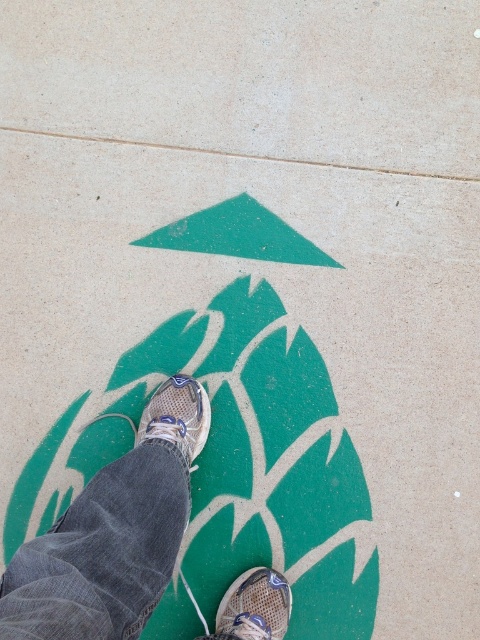
You are designing a poster and need to include both the textured beige sneakers at center and the mesh athletic shoe at center. Since the poster requires one shoe to be bigger than the other, which shoe should you make larger to match the actual sizes?

The textured beige sneakers at center should be made larger because it has a larger size compared to the mesh athletic shoe at center.

You are trying to determine which shoe is covering the green arrow on the concrete. You see the textured beige sneakers at center and the matte gray running shoe at center. Which one is placed above the other?

The textured beige sneakers at center is positioned under the matte gray running shoe at center, so the matte gray running shoe at center is covering the green arrow.

You are a photographer trying to capture the painted green arrow and leaves on the ground. You notice the textured beige sneakers at center and the mesh athletic shoe at center are blocking part of the design. Which shoe should you move first to ensure the arrow and leaves are fully visible?

The textured beige sneakers at center is located above the mesh athletic shoe at center, so you should move the textured beige sneakers at center first to expose the lower part of the design where the arrow and leaves are positioned.